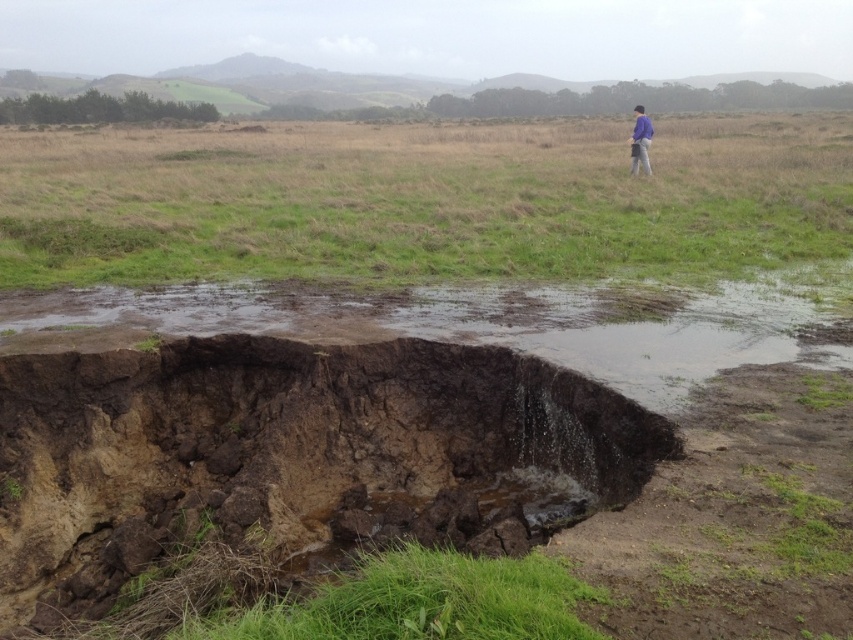
You are a hiker carrying a purple fabric jacket at upper right and need to cross the brown muddy hole at center. Can you safely jump across the hole without getting your jacket wet?

The distance between the brown muddy hole at center and purple fabric jacket at upper right is 14.23 meters. Since the hole is 14.23 meters wide, it would be extremely difficult to jump across safely. You should find another way to cross without getting your jacket wet.

You are a hiker who has just arrived at the scene and wants to cross the grassy field. You see the green grass at upper center and the purple fabric jacket at upper right. Which object is shorter in height?

The green grass at upper center has a lesser height compared to the purple fabric jacket at upper right, so the green grass at upper center is shorter.

You are a hiker who has spotted the brown muddy water at center and the purple fabric jacket at upper right in the distance. Which object is positioned more to the east if you are facing north?

The brown muddy water at center is to the left of the purple fabric jacket at upper right. Since you are facing north, left would correspond to the west direction. Therefore, the brown muddy water at center is positioned more to the west, making the purple fabric jacket at upper right the easternmost object.